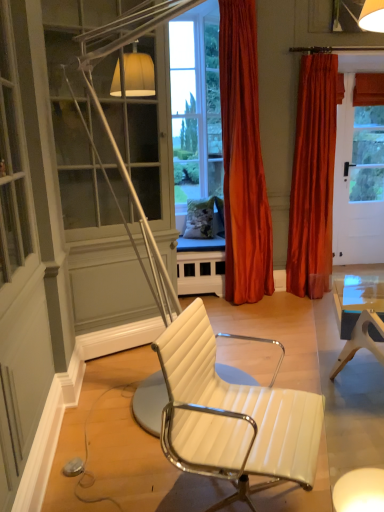
Question: Considering the relative sizes of velvet orange curtain at right, the first curtain when ordered from right to left, and white leather chair at center in the image provided, is velvet orange curtain at right, the first curtain when ordered from right to left, smaller than white leather chair at center?

Choices:
 (A) yes
 (B) no

Answer: (B)

Question: Considering the relative positions of velvet orange curtain at right, the first curtain when ordered from right to left, and white leather chair at center in the image provided, is velvet orange curtain at right, the first curtain when ordered from right to left, to the right of white leather chair at center from the viewer's perspective?

Choices:
 (A) yes
 (B) no

Answer: (A)

Question: Is velvet orange curtain at right, the first curtain when ordered from right to left, touching white leather chair at center?

Choices:
 (A) no
 (B) yes

Answer: (A)

Question: Is velvet orange curtain at right, the first curtain when ordered from right to left, not near white leather chair at center?

Choices:
 (A) no
 (B) yes

Answer: (B)

Question: Is velvet orange curtain at right, which ranks as the 2th curtain in left-to-right order, shorter than white leather chair at center?

Choices:
 (A) no
 (B) yes

Answer: (A)

Question: From a real-world perspective, is velvet orange curtain at right, which ranks as the 2th curtain in left-to-right order, over white leather chair at center?

Choices:
 (A) no
 (B) yes

Answer: (B)

Question: Could satin orange curtain at center, positioned as the first curtain in left-to-right order, be considered to be inside white leather chair at center?

Choices:
 (A) no
 (B) yes

Answer: (A)

Question: Is white leather chair at center positioned beyond the bounds of satin orange curtain at center, positioned as the first curtain in left-to-right order?

Choices:
 (A) yes
 (B) no

Answer: (A)

Question: Does white leather chair at center have a lesser height compared to satin orange curtain at center, arranged as the 2th curtain when viewed from the right?

Choices:
 (A) yes
 (B) no

Answer: (A)

Question: Considering the relative positions of white leather chair at center and satin orange curtain at center, arranged as the 2th curtain when viewed from the right, in the image provided, is white leather chair at center to the left of satin orange curtain at center, arranged as the 2th curtain when viewed from the right, from the viewer's perspective?

Choices:
 (A) yes
 (B) no

Answer: (A)

Question: Is white leather chair at center bigger than satin orange curtain at center, arranged as the 2th curtain when viewed from the right?

Choices:
 (A) yes
 (B) no

Answer: (B)

Question: From a real-world perspective, does white leather chair at center sit lower than satin orange curtain at center, positioned as the first curtain in left-to-right order?

Choices:
 (A) yes
 (B) no

Answer: (A)

Question: Is satin orange curtain at center, positioned as the first curtain in left-to-right order, at the right side of velvet orange curtain at right, the first curtain when ordered from right to left?

Choices:
 (A) no
 (B) yes

Answer: (A)